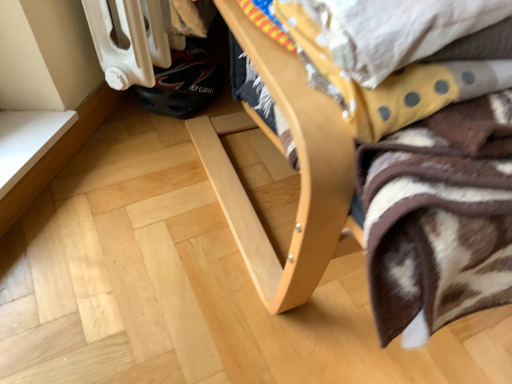
Question: Is natural wood bed frame at center situated inside yellow dotted fabric at upper right or outside?

Choices:
 (A) outside
 (B) inside

Answer: (A)

Question: Looking at their shapes, would you say natural wood bed frame at center is wider or thinner than yellow dotted fabric at upper right?

Choices:
 (A) wide
 (B) thin

Answer: (A)

Question: From the image's perspective, is natural wood bed frame at center located above or below yellow dotted fabric at upper right?

Choices:
 (A) below
 (B) above

Answer: (B)

Question: Is yellow dotted fabric at upper right wider or thinner than natural wood bed frame at center?

Choices:
 (A) thin
 (B) wide

Answer: (A)

Question: Would you say yellow dotted fabric at upper right is to the left or to the right of natural wood bed frame at center in the picture?

Choices:
 (A) left
 (B) right

Answer: (A)

Question: From the image's perspective, is yellow dotted fabric at upper right positioned above or below natural wood bed frame at center?

Choices:
 (A) below
 (B) above

Answer: (A)

Question: Relative to natural wood bed frame at center, is yellow dotted fabric at upper right in front or behind?

Choices:
 (A) front
 (B) behind

Answer: (B)